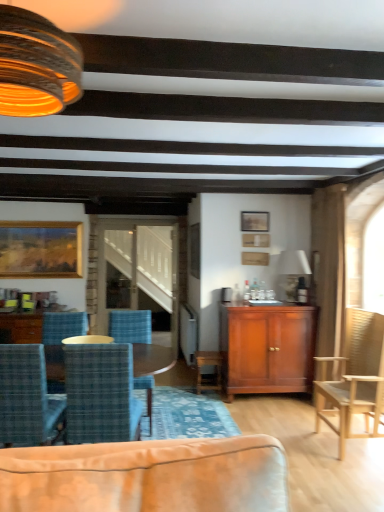
Question: Is there a large distance between wooden framed painting at upper left, the third picture frame positioned from the right, and blue plaid fabric chair at center, positioned as the third chair in left-to-right order?

Choices:
 (A) no
 (B) yes

Answer: (B)

Question: Is wooden framed painting at upper left, which appears as the 1th picture frame when viewed from the left, behind blue plaid fabric chair at center, positioned as the third chair in left-to-right order?

Choices:
 (A) yes
 (B) no

Answer: (A)

Question: Does wooden framed painting at upper left, the third picture frame in the front-to-back sequence, have a greater height compared to blue plaid fabric chair at center, which ranks as the 2th chair in right-to-left order?

Choices:
 (A) no
 (B) yes

Answer: (A)

Question: Can you confirm if wooden framed painting at upper left, the third picture frame positioned from the right, is thinner than blue plaid fabric chair at center, which ranks as the 2th chair in right-to-left order?

Choices:
 (A) no
 (B) yes

Answer: (B)

Question: Is blue plaid fabric chair at center, which ranks as the 2th chair in right-to-left order, surrounded by wooden framed painting at upper left, the 1th picture frame in the back-to-front sequence?

Choices:
 (A) yes
 (B) no

Answer: (B)

Question: Is wooden framed painting at upper left, which appears as the 1th picture frame when viewed from the left, not within blue plaid fabric chair at center, positioned as the third chair in left-to-right order?

Choices:
 (A) yes
 (B) no

Answer: (A)

Question: Does wooden glossy coffee table at lower left have a greater width compared to matte glass lampshade at upper left, which appears as the 1th lamp when viewed from the top?

Choices:
 (A) no
 (B) yes

Answer: (B)

Question: Is wooden glossy coffee table at lower left outside of matte glass lampshade at upper left, which is counted as the 1th lamp, starting from the left?

Choices:
 (A) yes
 (B) no

Answer: (A)

Question: Is wooden glossy coffee table at lower left turned away from matte glass lampshade at upper left, arranged as the 2th lamp when viewed from the right?

Choices:
 (A) no
 (B) yes

Answer: (A)

Question: Is wooden glossy coffee table at lower left positioned in front of matte glass lampshade at upper left, arranged as the first lamp when viewed from the front?

Choices:
 (A) no
 (B) yes

Answer: (A)

Question: Does wooden glossy coffee table at lower left come behind matte glass lampshade at upper left, the second lamp in the back-to-front sequence?

Choices:
 (A) no
 (B) yes

Answer: (B)

Question: Can you confirm if wooden glossy coffee table at lower left is taller than matte glass lampshade at upper left, which is counted as the 1th lamp, starting from the left?

Choices:
 (A) yes
 (B) no

Answer: (A)

Question: Is wooden picture frame at upper center, acting as the second picture frame starting from the back, facing away from matte white lampshade at upper center, the 1th lamp positioned from the back?

Choices:
 (A) no
 (B) yes

Answer: (A)